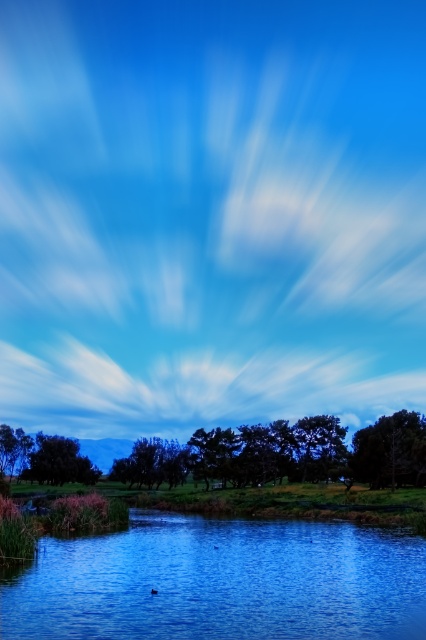
Is blue glassy river at lower center smaller than green matte tree at center?

No, blue glassy river at lower center is not smaller than green matte tree at center.

Looking at this image, is blue glassy river at lower center bigger than green matte tree at center?

Correct, blue glassy river at lower center is larger in size than green matte tree at center.

The height and width of the screenshot is (640, 426). I want to click on blue glassy river at lower center, so click(221, 582).

Describe the element at coordinates (221, 582) in the screenshot. I see `blue glassy river at lower center` at that location.

Which is above, blue glassy river at lower center or green matte tree at center-right?

blue glassy river at lower center is above.

Identify the location of blue glassy river at lower center. This screenshot has width=426, height=640. (221, 582).

Is green leafy trees at center thinner than green matte tree at center-right?

No, green leafy trees at center is not thinner than green matte tree at center-right.

Is green leafy trees at center taller than green matte tree at center-right?

Indeed, green leafy trees at center has a greater height compared to green matte tree at center-right.

In the scene shown: Who is more forward, [273,468] or [354,454]?

Positioned in front is point [354,454].

The image size is (426, 640). Identify the location of green leafy trees at center. (284, 452).